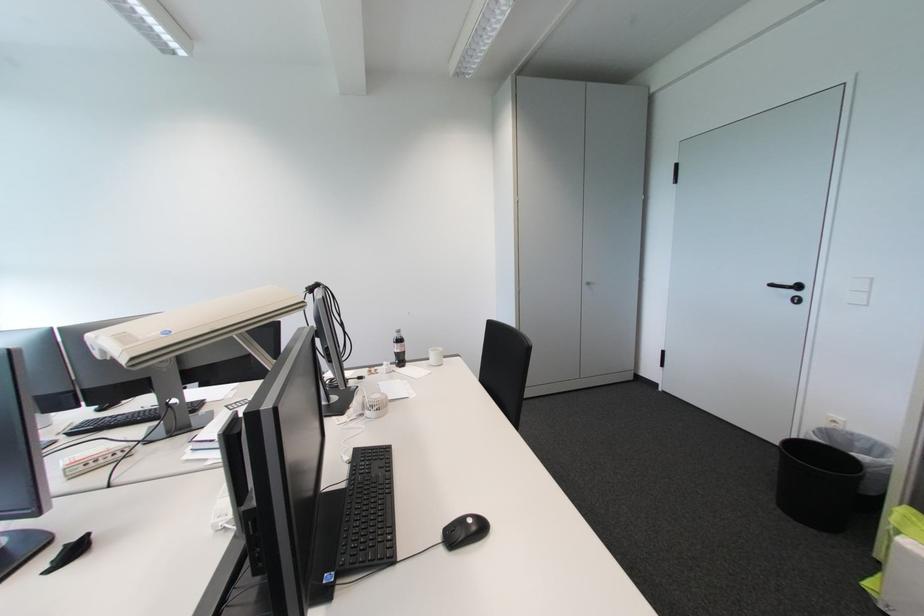
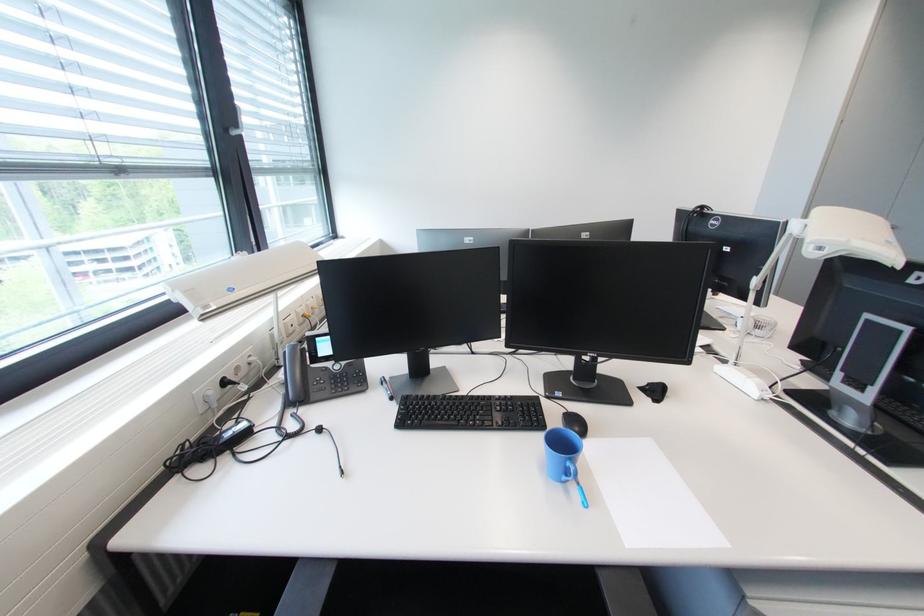
Where in the second image is the point corresponding to [103,339] from the first image?

(856, 243)